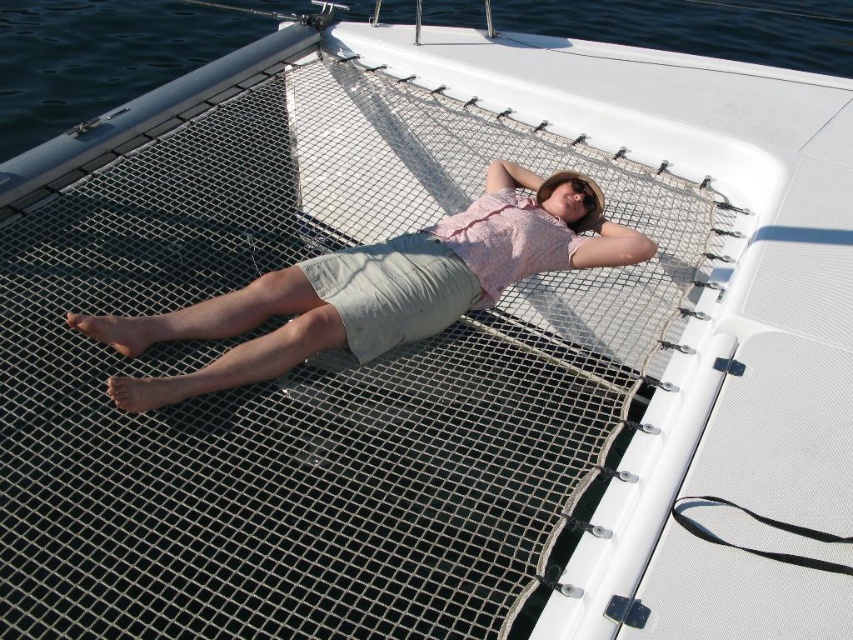
Question: Is pink fabric shirt at center above transparent water at upper left?

Choices:
 (A) yes
 (B) no

Answer: (B)

Question: Which of the following is the closest to the observer?

Choices:
 (A) (527, 8)
 (B) (454, 266)

Answer: (B)

Question: Does pink fabric shirt at center lie in front of transparent water at upper left?

Choices:
 (A) yes
 (B) no

Answer: (A)

Question: Which point is closer to the camera?

Choices:
 (A) (490, 211)
 (B) (45, 109)

Answer: (A)

Question: Which point is closer to the camera taking this photo?

Choices:
 (A) (386, 284)
 (B) (751, 33)

Answer: (A)

Question: Is pink fabric shirt at center in front of transparent water at upper left?

Choices:
 (A) no
 (B) yes

Answer: (B)